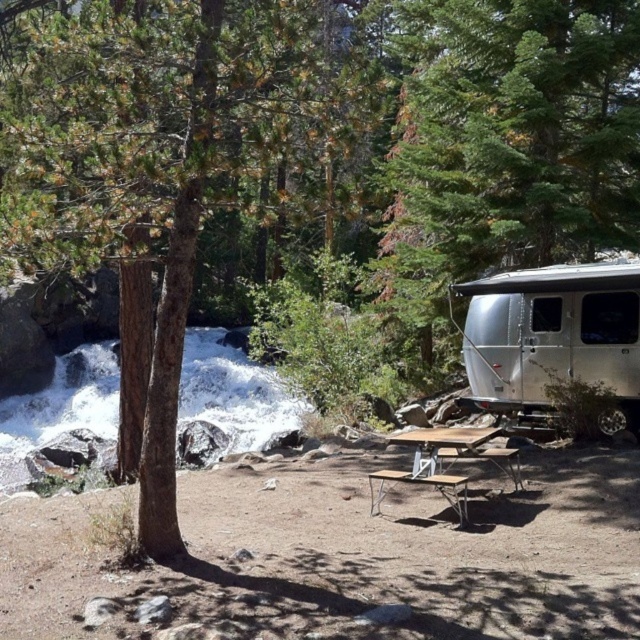
Question: Which object is positioned farthest from the silver metallic trailer at right?

Choices:
 (A) brown wood picnic table at center
 (B) brown rough tree at center
 (C) white frothy water at left
 (D) silver metallic camper at right

Answer: (C)

Question: Does silver metallic camper at right have a larger size compared to white frothy water at left?

Choices:
 (A) no
 (B) yes

Answer: (A)

Question: Which is nearer to the white frothy water at left?

Choices:
 (A) silver metallic camper at right
 (B) silver metallic trailer at right
 (C) brown rough tree at center
 (D) brown wood picnic table at center

Answer: (C)

Question: Can you confirm if white frothy water at left is positioned to the right of brown wood picnic table at center?

Choices:
 (A) no
 (B) yes

Answer: (A)

Question: Can you confirm if brown rough tree at center is positioned to the left of silver metallic camper at right?

Choices:
 (A) yes
 (B) no

Answer: (A)

Question: Estimate the real-world distances between objects in this image. Which object is closer to the brown wood picnic table at center?

Choices:
 (A) brown rough tree at center
 (B) silver metallic trailer at right
 (C) white frothy water at left

Answer: (B)